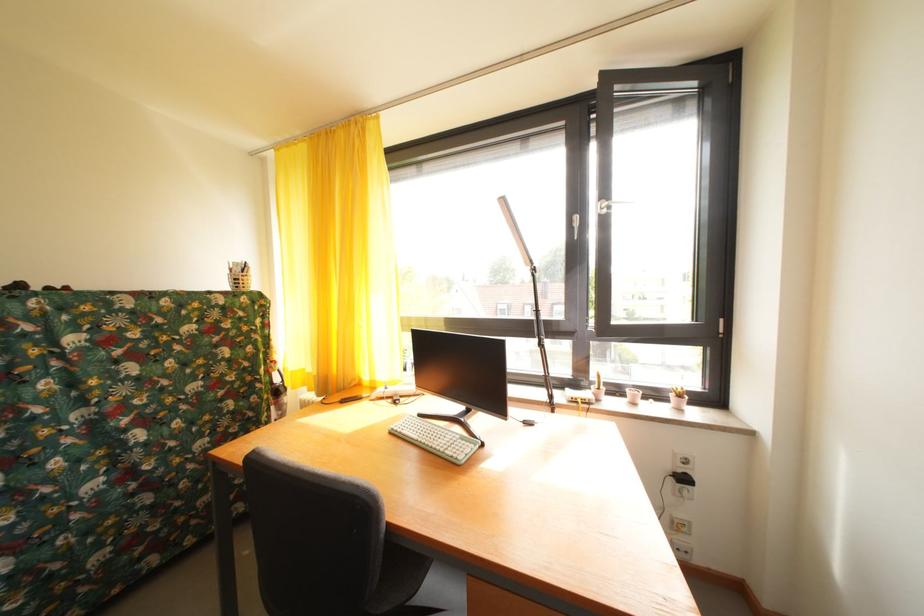
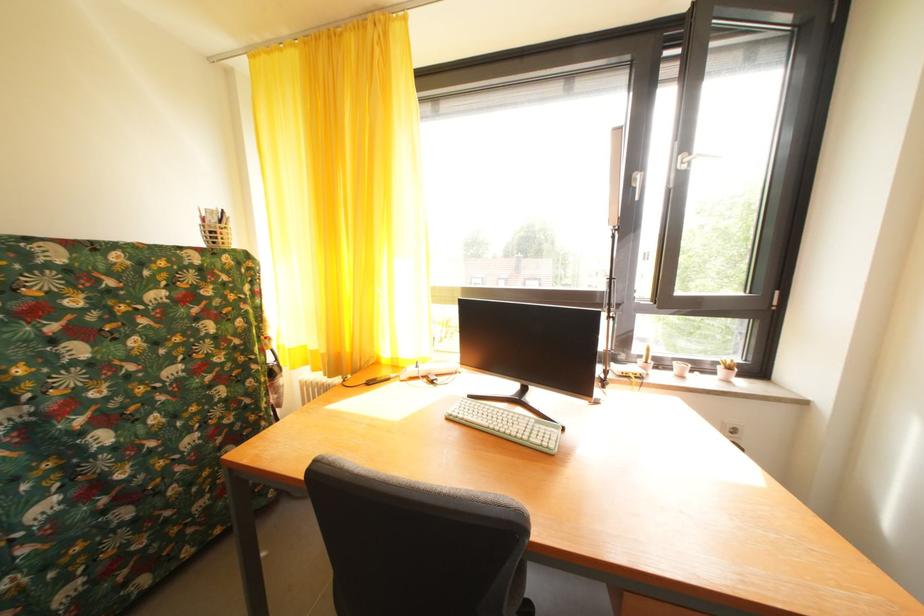
Where in the second image is the point corresponding to point (637, 397) from the first image?

(685, 370)